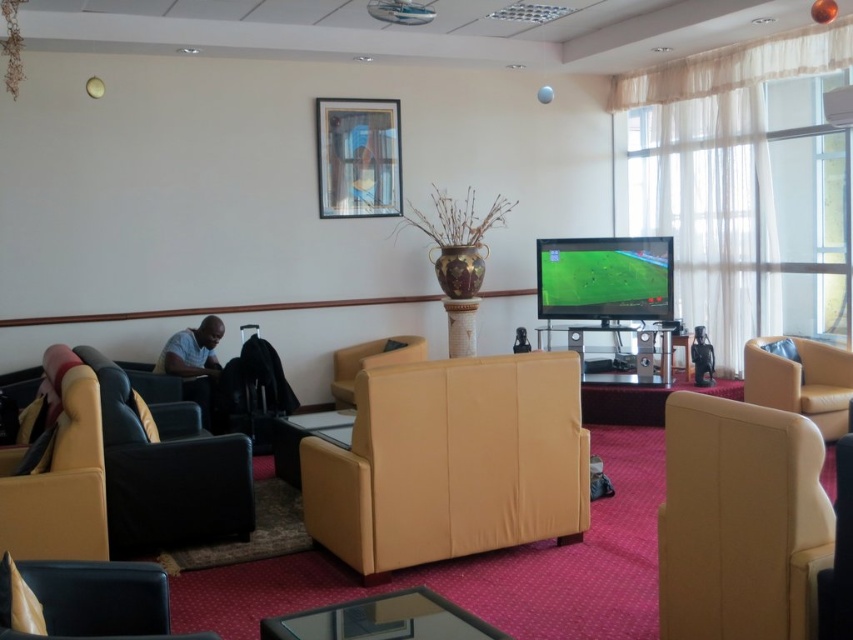
You are sitting on the sofa in the lounge and want to move to the matte black chair at lower left. Which direction should you turn to face the matte yellow armchair at left?

You should turn to your left to face the matte yellow armchair at left, since it is located to the left of the matte black chair at lower left.

You are sitting on the floor and want to move to the sofa across the room. There is a matte yellow armchair at left and a matte black chair at lower left in your way. Which chair do you need to move around to reach the sofa?

The matte yellow armchair at left is positioned over the matte black chair at lower left, so you need to move around the matte yellow armchair at left to reach the sofa.

You are standing at point (x=383, y=620) in the lounge. What object is located exactly at this coordinate?

The transparent glass table at lower center is located exactly at point (x=383, y=620).